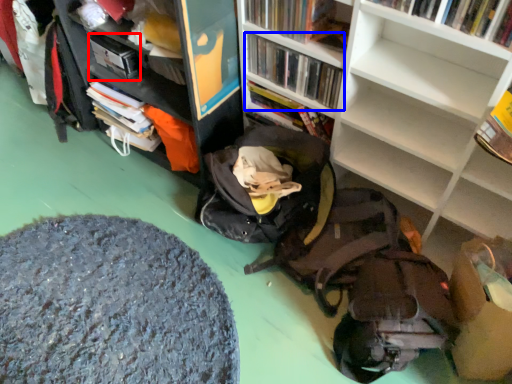
Question: Which object appears farthest to the camera in this image, paperback book (highlighted by a red box) or book (highlighted by a blue box)?

Choices:
 (A) paperback book
 (B) book

Answer: (A)